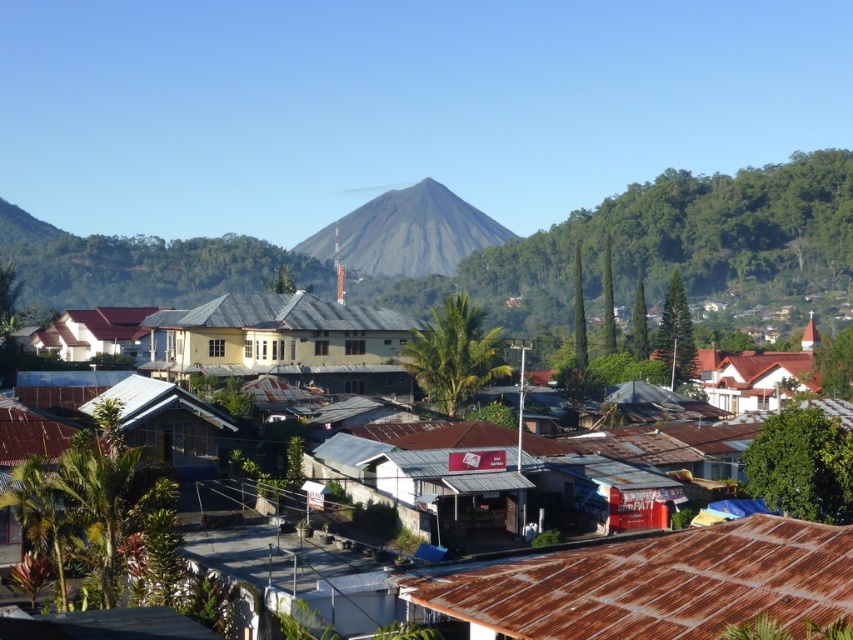
Who is positioned more to the right, rusty corrugated roof at lower right or gray matte mountain at center?

From the viewer's perspective, rusty corrugated roof at lower right appears more on the right side.

Which of these two, rusty corrugated roof at lower right or gray matte mountain at center, stands taller?

gray matte mountain at center

Describe the element at coordinates (656, 584) in the screenshot. I see `rusty corrugated roof at lower right` at that location.

Where is `rusty corrugated roof at lower right`? rusty corrugated roof at lower right is located at coordinates (656, 584).

Can you confirm if rusty metal roofs at center is smaller than brown corrugated metal hut at lower left?

No.

Is rusty metal roofs at center below brown corrugated metal hut at lower left?

Incorrect, rusty metal roofs at center is not positioned below brown corrugated metal hut at lower left.

Between point (560, 474) and point (171, 396), which one is positioned in front?

Point (560, 474) is in front.

You are a GUI agent. You are given a task and a screenshot of the screen. Output one action in this format:
    pyautogui.click(x=<x>, y=<y>)
    Task: Click on the rusty metal roofs at center
    The image size is (853, 640).
    Given the screenshot: What is the action you would take?
    pyautogui.click(x=601, y=467)

Which is below, gray matte mountain at center or brown corrugated metal hut at lower left?

brown corrugated metal hut at lower left is below.

Can you confirm if gray matte mountain at center is shorter than brown corrugated metal hut at lower left?

No.

Find the location of a particular element. The image size is (853, 640). gray matte mountain at center is located at coordinates coord(405,232).

Identify the location of gray matte mountain at center. (405, 232).